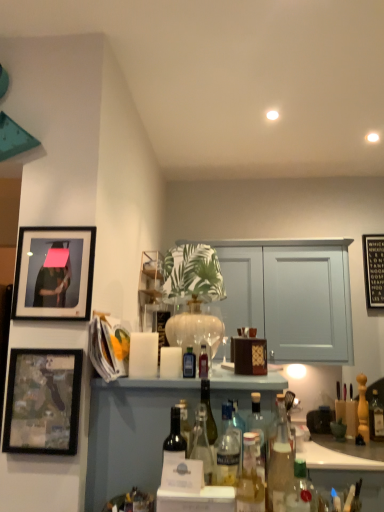
Question: Should I look upward or downward to see clear glass bottle at center, the 5th bottle when ordered from front to back?

Choices:
 (A) up
 (B) down

Answer: (B)

Question: Is translucent glass bottle at lower right, the 8th bottle in the left-to-right sequence, facing away from clear glass bottle at center, the sixth bottle in the left-to-right sequence?

Choices:
 (A) yes
 (B) no

Answer: (B)

Question: From the image's perspective, is translucent glass bottle at lower right, the 8th bottle viewed from the back, below clear glass bottle at center, the fourth bottle viewed from the right?

Choices:
 (A) no
 (B) yes

Answer: (B)

Question: Does translucent glass bottle at lower right, which is the 2th bottle in front-to-back order, appear on the left side of clear glass bottle at center, the fourth bottle viewed from the right?

Choices:
 (A) no
 (B) yes

Answer: (A)

Question: Can you confirm if translucent glass bottle at lower right, which is the 2th bottle in front-to-back order, is wider than clear glass bottle at center, the sixth bottle in the left-to-right sequence?

Choices:
 (A) no
 (B) yes

Answer: (B)

Question: Considering the relative sizes of translucent glass bottle at lower right, which is the 2th bottle from right to left, and clear glass bottle at center, the sixth bottle in the left-to-right sequence, in the image provided, is translucent glass bottle at lower right, which is the 2th bottle from right to left, taller than clear glass bottle at center, the sixth bottle in the left-to-right sequence,?

Choices:
 (A) no
 (B) yes

Answer: (A)

Question: Does translucent glass bottle at lower right, which is the 2th bottle in front-to-back order, have a smaller size compared to clear glass bottle at center, the 5th bottle when ordered from front to back?

Choices:
 (A) yes
 (B) no

Answer: (B)

Question: Is translucent glass bottle at center, which ranks as the first bottle in front-to-back order, shorter than wooden framed picture at lower left, the 3th picture frame from the back?

Choices:
 (A) no
 (B) yes

Answer: (B)

Question: From a real-world perspective, is translucent glass bottle at center, which appears as the 9th bottle when viewed from the back, under wooden framed picture at lower left, the 3th picture frame from the back?

Choices:
 (A) yes
 (B) no

Answer: (A)

Question: Can you confirm if translucent glass bottle at center, the 5th bottle viewed from the left, is thinner than wooden framed picture at lower left, acting as the 3th picture frame starting from the right?

Choices:
 (A) no
 (B) yes

Answer: (A)

Question: Could wooden framed picture at lower left, acting as the 3th picture frame starting from the right, be considered to be inside translucent glass bottle at center, which ranks as the first bottle in front-to-back order?

Choices:
 (A) no
 (B) yes

Answer: (A)

Question: Considering the relative positions of translucent glass bottle at center, which ranks as the first bottle in front-to-back order, and wooden framed picture at lower left, the first picture frame when ordered from left to right, in the image provided, is translucent glass bottle at center, which ranks as the first bottle in front-to-back order, behind wooden framed picture at lower left, the first picture frame when ordered from left to right,?

Choices:
 (A) yes
 (B) no

Answer: (B)

Question: Is translucent glass bottle at center, which appears as the 9th bottle when viewed from the back, wider than wooden framed picture at lower left, the first picture frame when ordered from left to right?

Choices:
 (A) yes
 (B) no

Answer: (A)

Question: Considering the relative sizes of dark glass bottle at center, acting as the second bottle starting from the back, and dark glass bottle at center, the 9th bottle in the right-to-left sequence, in the image provided, is dark glass bottle at center, acting as the second bottle starting from the back, taller than dark glass bottle at center, the 9th bottle in the right-to-left sequence,?

Choices:
 (A) no
 (B) yes

Answer: (A)